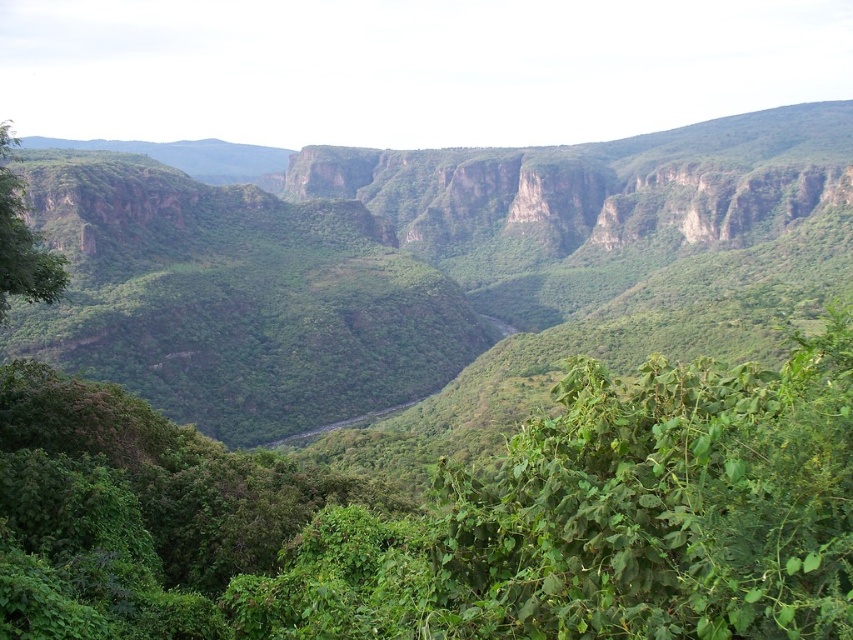
Who is more distant from viewer, (228,412) or (41,256)?

Point (228,412)

Is green leafy vegetation at center wider than green leafy tree at left?

Yes, green leafy vegetation at center is wider than green leafy tree at left.

Is point (125, 257) positioned behind point (38, 285)?

Yes.

Identify the location of green leafy vegetation at center. This screenshot has height=640, width=853. (428, 268).